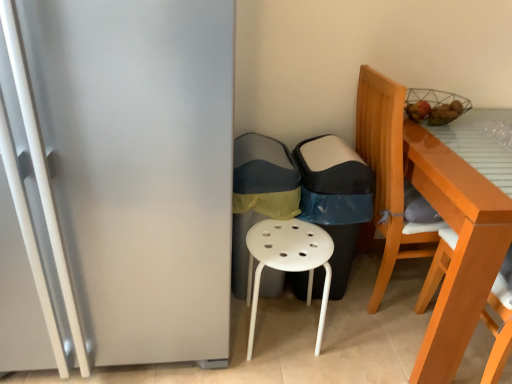
Question: Choose the correct answer: Is satin silver fridge at left inside gray fabric trash can at center, positioned as the first garbage in left-to-right order, or outside it?

Choices:
 (A) inside
 (B) outside

Answer: (B)

Question: From a real-world perspective, is satin silver fridge at left above or below gray fabric trash can at center, positioned as the 2th garbage in right-to-left order?

Choices:
 (A) below
 (B) above

Answer: (B)

Question: Estimate the real-world distances between objects in this image. Which object is farther from the gray fabric trash can at center, positioned as the 2th garbage in right-to-left order?

Choices:
 (A) wooden chair at right, the second chair from the right
 (B) satin silver fridge at left
 (C) white plastic stool at center
 (D) light brown wooden chair at right, the 2th chair in the left-to-right sequence
 (E) black plastic trash can at center, the second garbage viewed from the left

Answer: (D)

Question: Which is nearer to the white plastic stool at center?

Choices:
 (A) satin silver fridge at left
 (B) black plastic trash can at center, the second garbage viewed from the left
 (C) light brown wooden chair at right, the 2th chair in the left-to-right sequence
 (D) wooden chair at right, marked as the 1th chair in a left-to-right arrangement
 (E) gray fabric trash can at center, positioned as the 2th garbage in right-to-left order

Answer: (E)